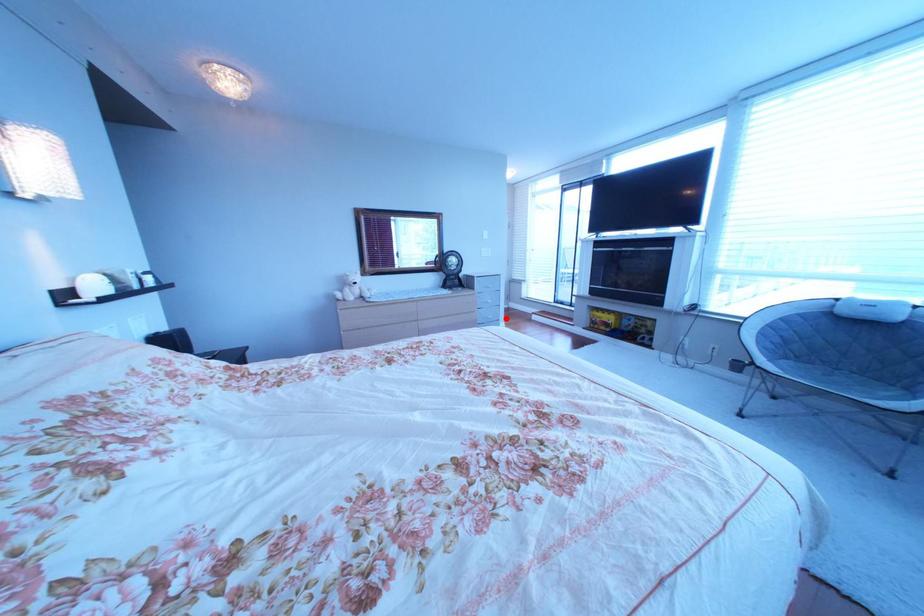
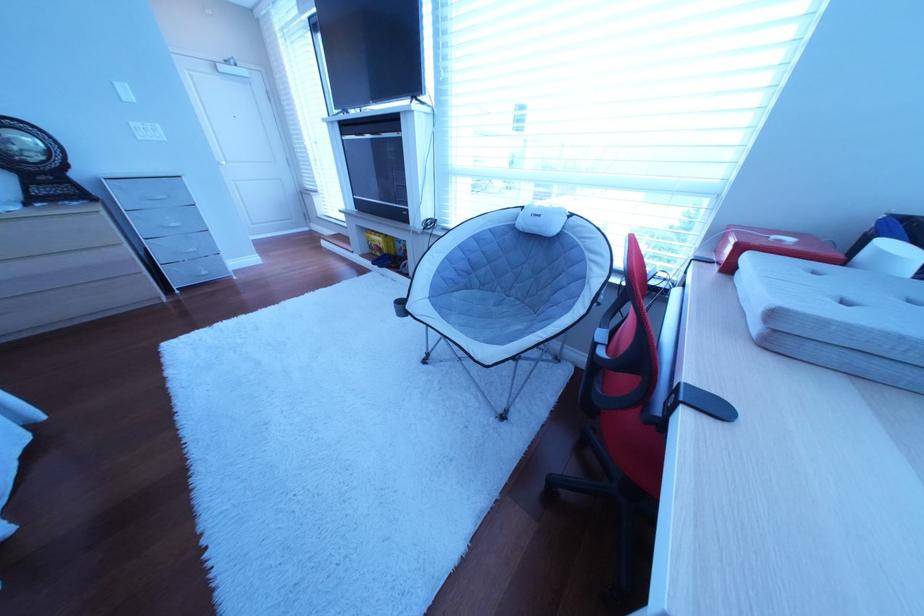
The point at the highlighted location is marked in the first image. Where is the corresponding point in the second image?

(207, 252)